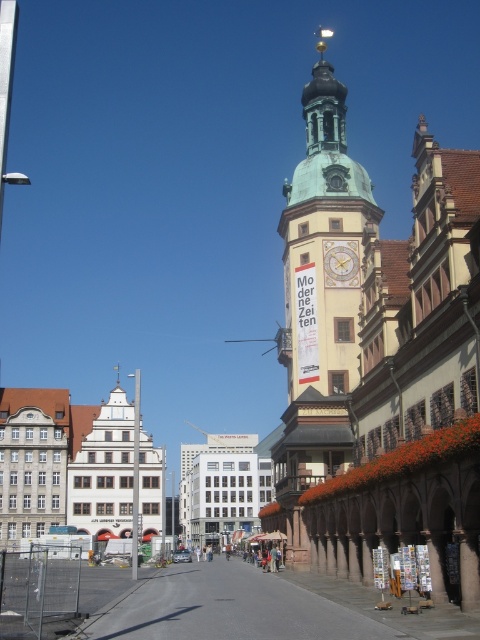
Is point (308, 352) farther from camera compared to point (337, 275)?

No, it is not.

Does point (291, 188) lie in front of point (323, 243)?

No, (291, 188) is behind (323, 243).

Between point (317, 145) and point (335, 280), which one is positioned in front?

Point (335, 280) is more forward.

The width and height of the screenshot is (480, 640). I want to click on yellowish stone clock tower at center, so click(322, 243).